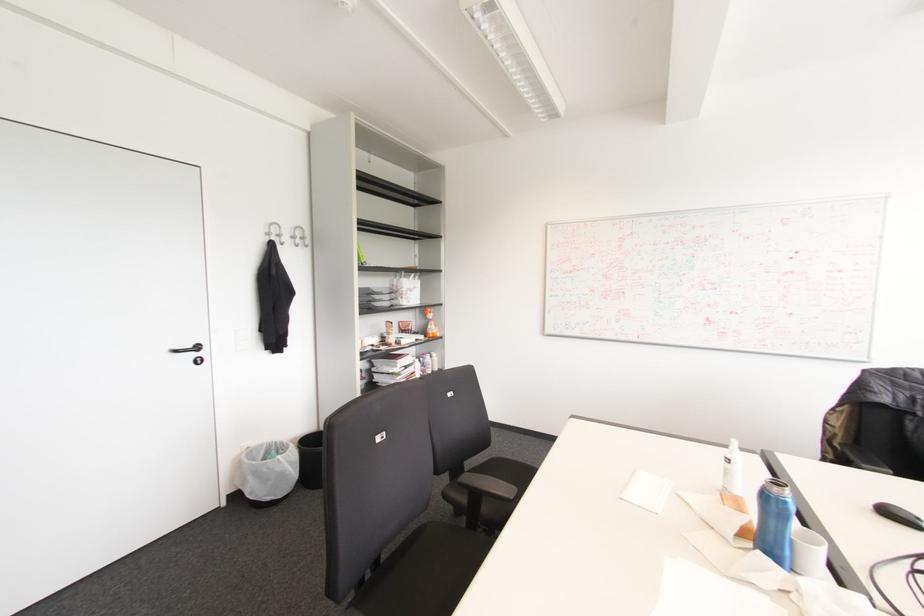
In order to click on black chair armrest in this screenshot , I will do `click(487, 485)`.